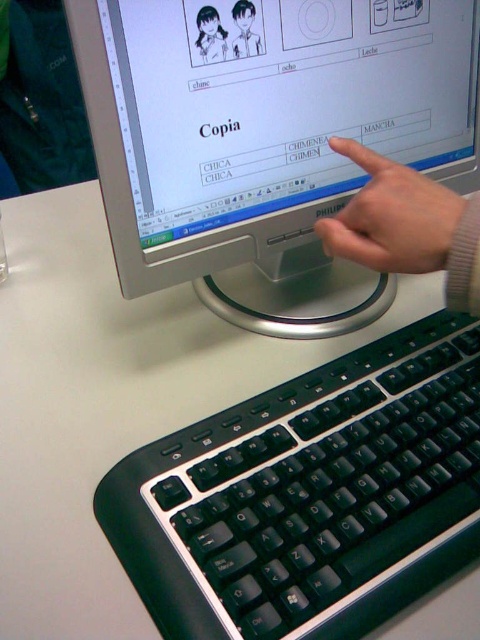
Between point (425, 26) and point (333, 140), which one is positioned behind?

Point (425, 26)

Which of these two, satin silver monitor at center or flesh-toned skin at upper center, stands taller?

satin silver monitor at center is taller.

Is point (143, 202) closer to viewer compared to point (406, 240)?

No, (143, 202) is behind (406, 240).

This screenshot has height=640, width=480. In order to click on satin silver monitor at center in this screenshot , I will do `click(267, 140)`.

Does matte black character at upper left appear under matte black character at upper center?

Indeed, matte black character at upper left is positioned under matte black character at upper center.

Is matte black character at upper left wider than matte black character at upper center?

Yes, matte black character at upper left is wider than matte black character at upper center.

Between point (219, 33) and point (240, 36), which one is positioned in front?

Point (219, 33) is more forward.

I want to click on matte black character at upper left, so click(x=211, y=35).

This screenshot has width=480, height=640. What are the coordinates of `flesh-toned skin at upper center` in the screenshot? It's located at (392, 216).

Identify the location of flesh-toned skin at upper center. (392, 216).